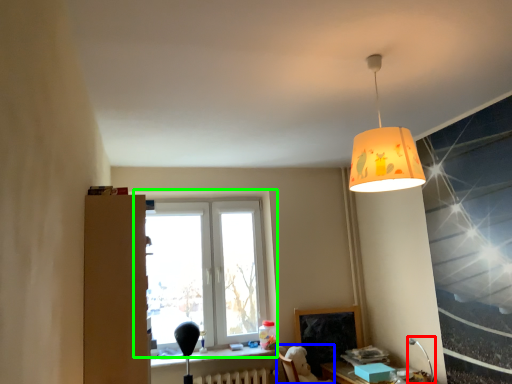
Question: Considering the real-world distances, which object is closest to table lamp (highlighted by a red box)? swivel chair (highlighted by a blue box) or window (highlighted by a green box).

Choices:
 (A) swivel chair
 (B) window

Answer: (A)